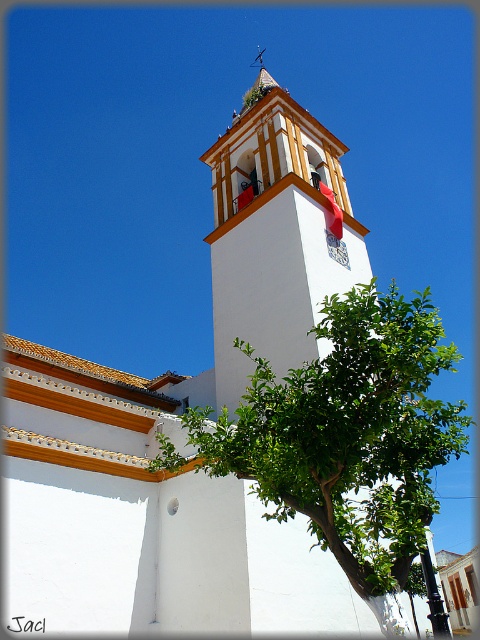
Is green leafy tree at center shorter than white stucco tower at center?

Indeed, green leafy tree at center has a lesser height compared to white stucco tower at center.

Is point (288, 515) positioned after point (288, 136)?

No, (288, 515) is closer to viewer.

At what (x,y) coordinates should I click in order to perform the action: click on green leafy tree at center. Please return your answer as a coordinate pair (x, y). This screenshot has height=640, width=480. Looking at the image, I should click on (348, 436).

Where is `green leafy tree at center`? The width and height of the screenshot is (480, 640). green leafy tree at center is located at coordinates (348, 436).